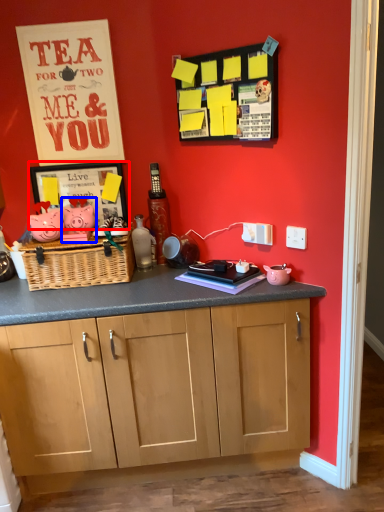
Question: Which object appears farthest to the camera in this image, picture frame (highlighted by a red box) or toy (highlighted by a blue box)?

Choices:
 (A) picture frame
 (B) toy

Answer: (A)